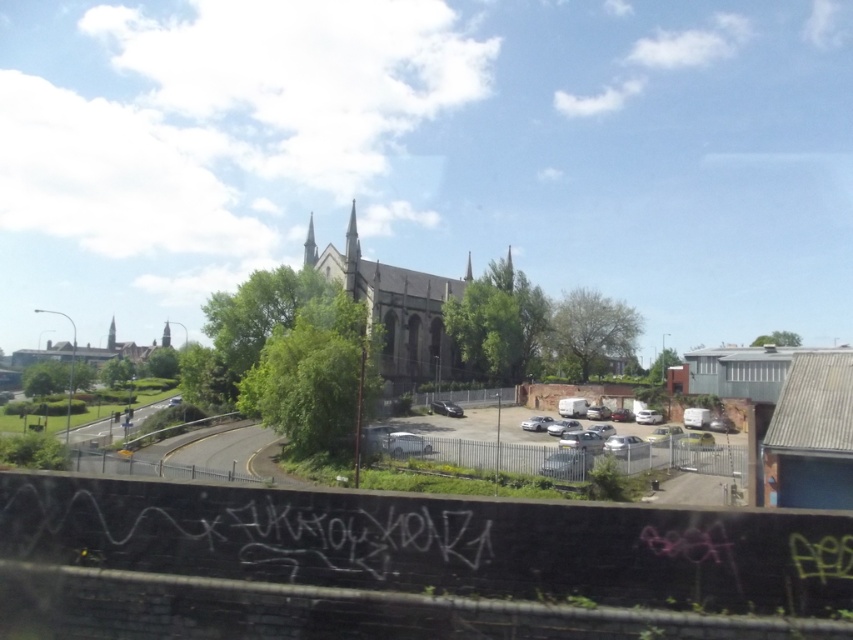
Question: Considering the relative positions of dark gray stone church at center and matte gray building at center in the image provided, where is dark gray stone church at center located with respect to matte gray building at center?

Choices:
 (A) left
 (B) right

Answer: (B)

Question: Which of the following is the farthest from the observer?

Choices:
 (A) (94, 349)
 (B) (367, 310)

Answer: (A)

Question: Considering the relative positions of dark gray stone church at center and matte gray building at center in the image provided, where is dark gray stone church at center located with respect to matte gray building at center?

Choices:
 (A) above
 (B) below

Answer: (A)

Question: Does dark gray stone church at center lie in front of matte gray building at center?

Choices:
 (A) no
 (B) yes

Answer: (B)

Question: Which object is farther from the camera taking this photo?

Choices:
 (A) matte gray building at center
 (B) dark gray stone church at center

Answer: (A)